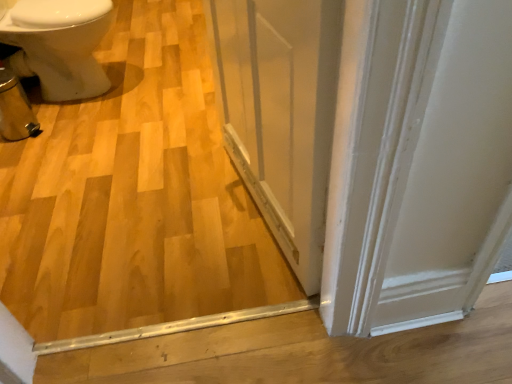
Describe the element at coordinates (280, 112) in the screenshot. I see `transparent glass screen door at center` at that location.

Where is `transparent glass screen door at center`? The width and height of the screenshot is (512, 384). transparent glass screen door at center is located at coordinates (280, 112).

What's the angular difference between white glossy bidet at left and transparent glass screen door at center's facing directions?

There is a 167-degree angle between the facing directions of white glossy bidet at left and transparent glass screen door at center.

Is white glossy bidet at left further to the viewer compared to transparent glass screen door at center?

Yes, white glossy bidet at left is behind transparent glass screen door at center.

Identify the location of screen door on the right of the white glossy bidet at left. The image size is (512, 384). (280, 112).

Between white glossy bidet at left and transparent glass screen door at center, which one has larger size?

white glossy bidet at left is bigger.

Is natural wood floor at center not inside white glossy bidet at left?

That's correct, natural wood floor at center is outside of white glossy bidet at left.

From the image's perspective, is natural wood floor at center below white glossy bidet at left?

Yes.

Between natural wood floor at center and white glossy bidet at left, which one appears on the left side from the viewer's perspective?

From the viewer's perspective, white glossy bidet at left appears more on the left side.

Looking at this image, from a real-world perspective, which is physically above, natural wood floor at center or white glossy bidet at left?

white glossy bidet at left.

Which object is closer to the camera taking this photo, transparent glass screen door at center or natural wood floor at center?

transparent glass screen door at center is more forward.

Are transparent glass screen door at center and natural wood floor at center located far from each other?

Actually, transparent glass screen door at center and natural wood floor at center are a little close together.

From the image's perspective, is transparent glass screen door at center positioned above or below natural wood floor at center?

From the image's perspective, transparent glass screen door at center appears below natural wood floor at center.

Can you tell me how much transparent glass screen door at center and natural wood floor at center differ in facing direction?

77.6 degrees separate the facing orientations of transparent glass screen door at center and natural wood floor at center.

Is transparent glass screen door at center directly adjacent to white glossy bidet at left?

transparent glass screen door at center is not next to white glossy bidet at left, and they're not touching.

From their relative heights in the image, would you say transparent glass screen door at center is taller or shorter than white glossy bidet at left?

Clearly, transparent glass screen door at center is taller compared to white glossy bidet at left.

From a real-world perspective, who is located higher, transparent glass screen door at center or white glossy bidet at left?

In real-world perspective, transparent glass screen door at center is above.

Can you confirm if white glossy bidet at left is taller than natural wood floor at center?

Yes, white glossy bidet at left is taller than natural wood floor at center.

Can you confirm if white glossy bidet at left is bigger than natural wood floor at center?

No, white glossy bidet at left is not bigger than natural wood floor at center.

Considering the points (74, 39) and (116, 218), which point is in front, point (74, 39) or point (116, 218)?

Point (116, 218)

Which object is wider, white glossy bidet at left or natural wood floor at center?

natural wood floor at center.

Do you think natural wood floor at center is within transparent glass screen door at center, or outside of it?

natural wood floor at center is spatially situated outside transparent glass screen door at center.

From the image's perspective, is natural wood floor at center above or below transparent glass screen door at center?

Based on their image positions, natural wood floor at center is located above transparent glass screen door at center.

Could you tell me if natural wood floor at center is turned towards transparent glass screen door at center?

No, natural wood floor at center does not turn towards transparent glass screen door at center.

Find the location of `plywood behind the transparent glass screen door at center`. plywood behind the transparent glass screen door at center is located at coordinates (135, 200).

This screenshot has width=512, height=384. Identify the location of screen door on the right of the white glossy bidet at left. (280, 112).

Identify the location of bidet located behind the natural wood floor at center. The height and width of the screenshot is (384, 512). (59, 45).

Which object lies nearer to the anchor point transparent glass screen door at center, white glossy bidet at left or natural wood floor at center?

The object closer to transparent glass screen door at center is natural wood floor at center.

Based on their spatial positions, is natural wood floor at center or transparent glass screen door at center further from white glossy bidet at left?

transparent glass screen door at center is further to white glossy bidet at left.

Estimate the real-world distances between objects in this image. Which object is closer to white glossy bidet at left, transparent glass screen door at center or natural wood floor at center?

Among the two, natural wood floor at center is located nearer to white glossy bidet at left.

When comparing their distances from transparent glass screen door at center, does natural wood floor at center or white glossy bidet at left seem closer?

natural wood floor at center is closer to transparent glass screen door at center.

From the image, which object appears to be nearer to natural wood floor at center, transparent glass screen door at center or white glossy bidet at left?

transparent glass screen door at center is positioned closer to the anchor natural wood floor at center.

Based on their spatial positions, is white glossy bidet at left or transparent glass screen door at center closer to natural wood floor at center?

transparent glass screen door at center is closer to natural wood floor at center.

Identify the location of plywood between white glossy bidet at left and transparent glass screen door at center. (135, 200).